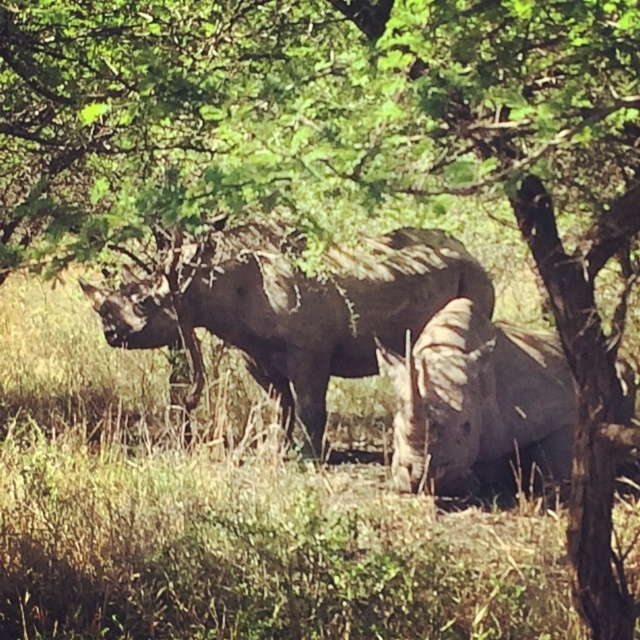
Can you confirm if dark gray textured rhino at center is smaller than gray matte rhinoceros at center?

No.

This screenshot has height=640, width=640. What do you see at coordinates (324, 305) in the screenshot? I see `dark gray textured rhino at center` at bounding box center [324, 305].

Locate an element on the screen. Image resolution: width=640 pixels, height=640 pixels. dark gray textured rhino at center is located at coordinates point(324,305).